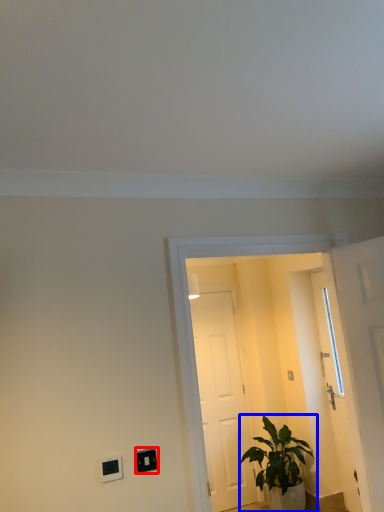
Question: Which object appears closest to the camera in this image, light switch (highlighted by a red box) or houseplant (highlighted by a blue box)?

Choices:
 (A) light switch
 (B) houseplant

Answer: (A)